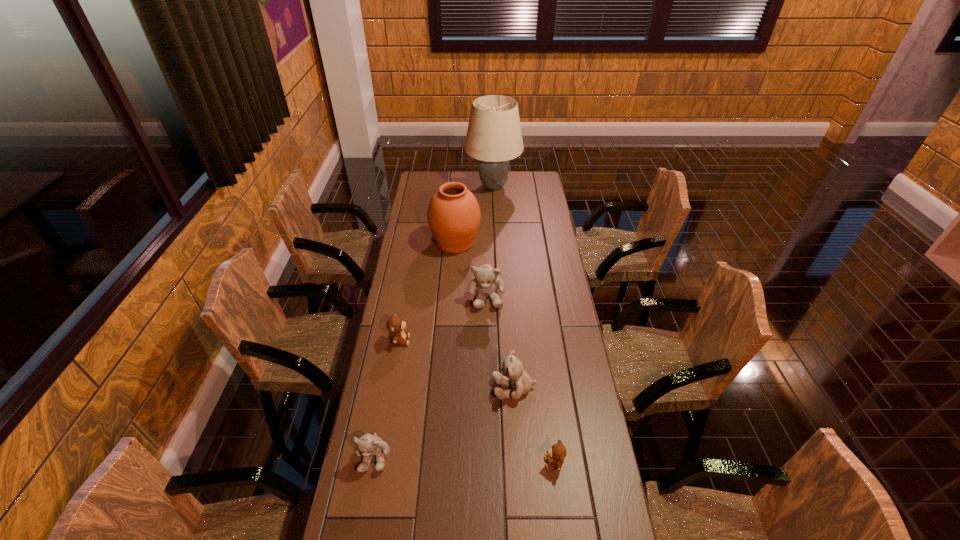
This screenshot has width=960, height=540. In order to click on the nearest gray teddy bear in this screenshot , I will do [368, 445].

Where is `the leftmost gray teddy bear`? The height and width of the screenshot is (540, 960). the leftmost gray teddy bear is located at coordinates (368, 445).

Locate an element on the screen. the smaller brown teddy bear is located at coordinates (556, 454).

Locate an element on the screen. the nearer brown teddy bear is located at coordinates (556, 454).

Find the location of a particular element. This screenshot has width=960, height=540. vacant position located on the front of the lampshade is located at coordinates (495, 232).

Image resolution: width=960 pixels, height=540 pixels. I want to click on vacant space located 0.070m on the front of the second farthest object, so click(x=453, y=269).

Identify the location of free location located on the face of the tallest teddy bear. The image size is (960, 540). (488, 375).

Identify the location of vacant region located on the face of the second farthest gray teddy bear. The width and height of the screenshot is (960, 540). (460, 388).

Find the location of `free space located 0.070m on the face of the second farthest gray teddy bear`. free space located 0.070m on the face of the second farthest gray teddy bear is located at coordinates (471, 388).

This screenshot has width=960, height=540. I want to click on vacant region located 0.350m on the face of the second farthest gray teddy bear, so click(x=389, y=388).